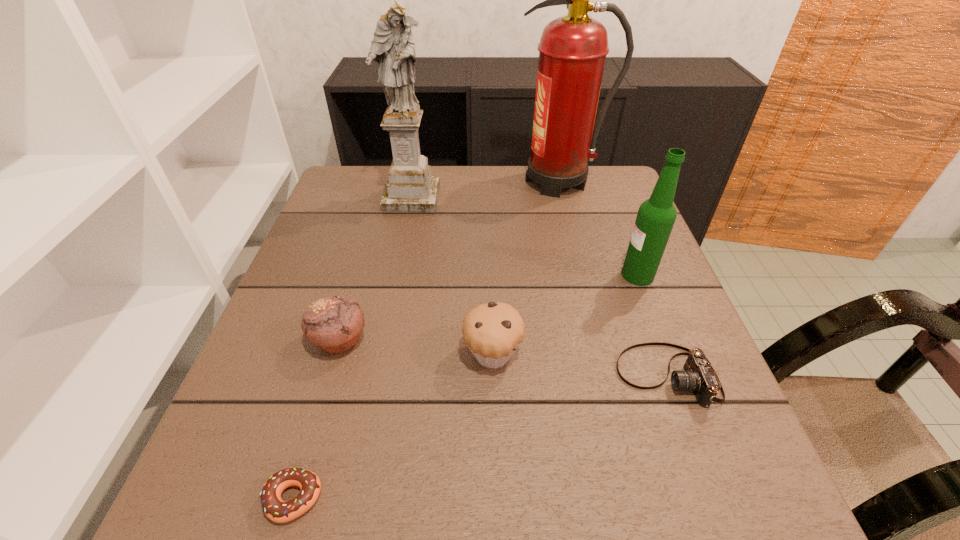
The width and height of the screenshot is (960, 540). Find the location of `object that ranks as the sixth closest to the right muffin`. object that ranks as the sixth closest to the right muffin is located at coordinates click(x=572, y=51).